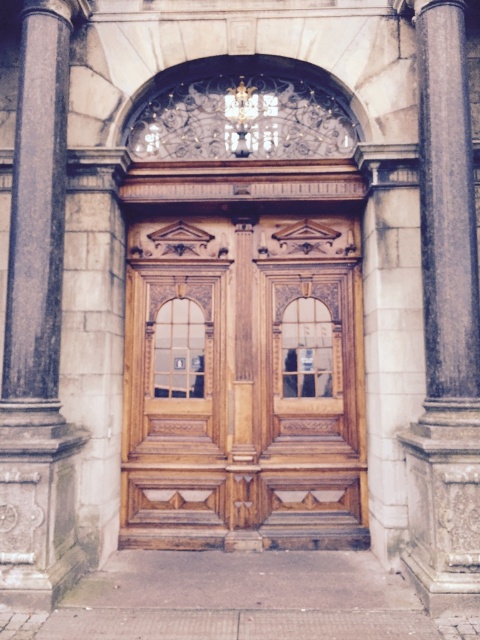
Between wooden door at center and brown polished stone column at right, which one appears on the left side from the viewer's perspective?

wooden door at center

Does wooden door at center appear over brown polished stone column at right?

No.

The width and height of the screenshot is (480, 640). I want to click on wooden door at center, so click(243, 384).

Locate an element on the screen. The width and height of the screenshot is (480, 640). wooden door at center is located at coordinates (243, 384).

Can you confirm if wooden door at center is positioned to the left of dark gray stone pillar at left?

In fact, wooden door at center is to the right of dark gray stone pillar at left.

Which is more to the right, wooden door at center or dark gray stone pillar at left?

wooden door at center

Measure the distance between point (254,413) and camera.

Point (254,413) is 8.33 meters from camera.

Where is `wooden door at center`? wooden door at center is located at coordinates (243, 384).

In the scene shown: Is dark gray stone pillar at left smaller than brown polished stone column at right?

Actually, dark gray stone pillar at left might be larger than brown polished stone column at right.

Who is more distant from viewer, (x=60, y=285) or (x=425, y=310)?

Positioned behind is point (x=60, y=285).

Measure the distance between dark gray stone pillar at left and camera.

A distance of 6.42 meters exists between dark gray stone pillar at left and camera.

I want to click on dark gray stone pillar at left, so click(37, 326).